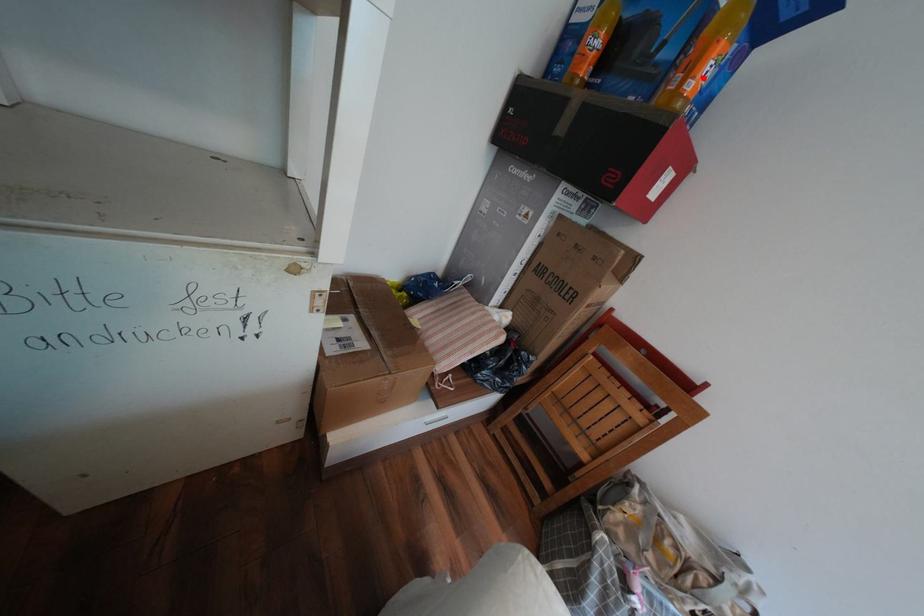
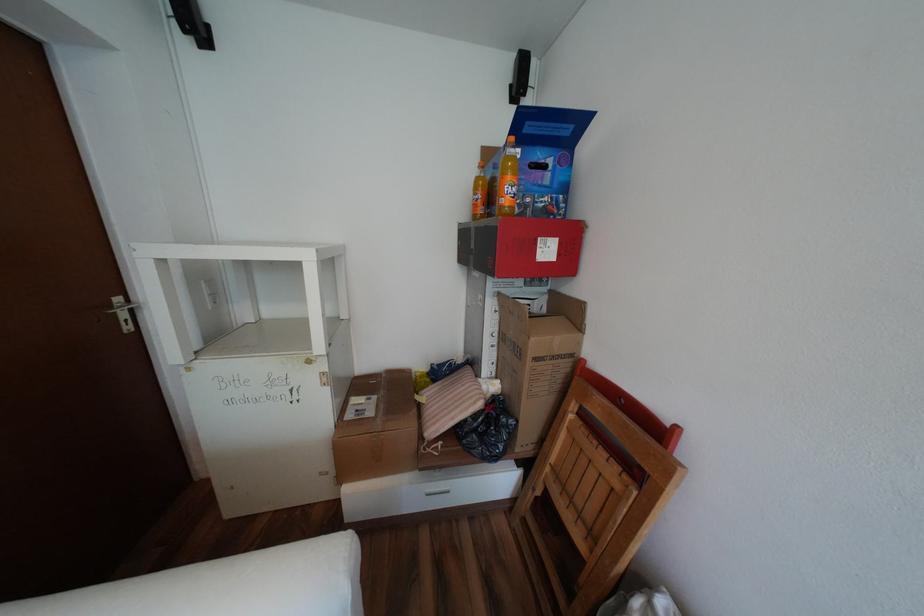
Where in the second image is the point corresponding to the highlighted location from the first image?

(512, 197)